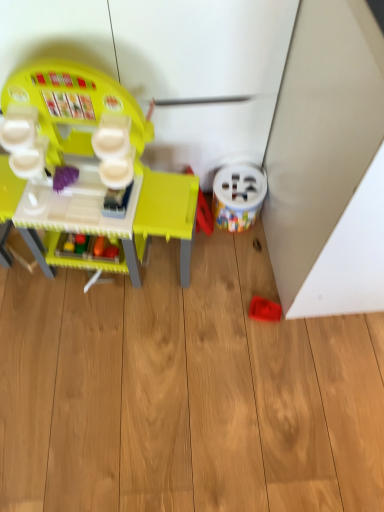
At what (x,y) coordinates should I click in order to perform the action: click on vacant space in between white plastic bucket at lower right, the 2th toy when ordered from left to right, and rubberized red toy at lower right, the 3th toy from the left. Please return your answer as a coordinate pair (x, y). The image size is (384, 512). Looking at the image, I should click on (246, 266).